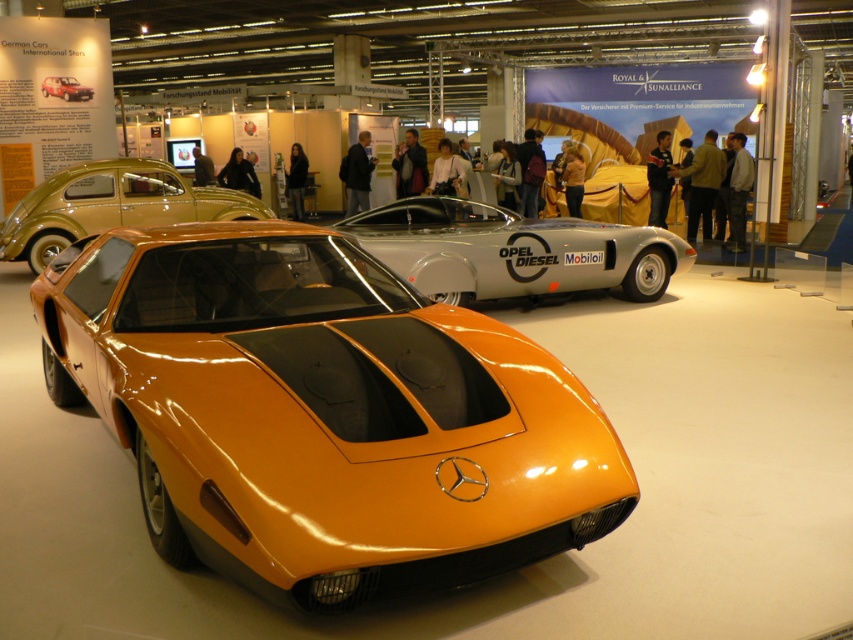
Does shiny orange car at center have a larger size compared to matte orange car at center?

Correct, shiny orange car at center is larger in size than matte orange car at center.

Is point (444, 552) farther from viewer compared to point (45, 93)?

No, (444, 552) is closer to viewer.

The image size is (853, 640). In order to click on shiny orange car at center in this screenshot , I will do `click(322, 412)`.

Does silver metallic sports car at center appear on the left side of orange glossy car at center?

Incorrect, silver metallic sports car at center is not on the left side of orange glossy car at center.

Who is higher up, silver metallic sports car at center or orange glossy car at center?

Result: orange glossy car at center is higher up.

Find the location of a particular element. The width and height of the screenshot is (853, 640). silver metallic sports car at center is located at coordinates (514, 252).

Does shiny orange car at center appear under orange glossy car at center?

Indeed, shiny orange car at center is positioned under orange glossy car at center.

What do you see at coordinates (322, 412) in the screenshot? I see `shiny orange car at center` at bounding box center [322, 412].

Is point (392, 401) positioned after point (86, 202)?

No, (392, 401) is in front of (86, 202).

The image size is (853, 640). What are the coordinates of `shiny orange car at center` in the screenshot? It's located at (322, 412).